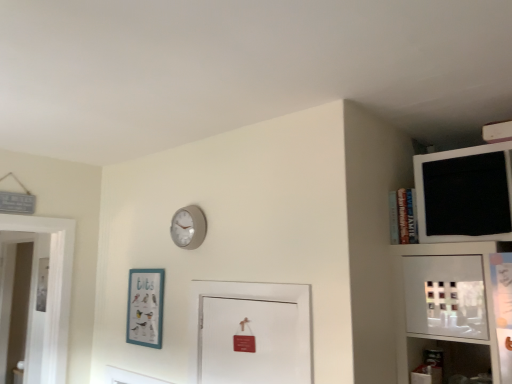
You are a GUI agent. You are given a task and a screenshot of the screen. Output one action in this format:
    pyautogui.click(x=<x>, y=<y>)
    Task: Click on the matte gray clock at upper center
    
    Given the screenshot: What is the action you would take?
    pyautogui.click(x=188, y=227)

Find the location of a particular element. black matte medicine cabinet at upper right is located at coordinates (465, 194).

From a real-world perspective, does black matte medicine cabinet at upper right sit lower than teal matte picture frame at lower left?

No.

Is the depth of black matte medicine cabinet at upper right greater than that of teal matte picture frame at lower left?

No, black matte medicine cabinet at upper right is closer to the camera.

Where is `medicine cabinet in front of the teal matte picture frame at lower left`? The image size is (512, 384). medicine cabinet in front of the teal matte picture frame at lower left is located at coordinates (465, 194).

Which object is thinner, black matte medicine cabinet at upper right or teal matte picture frame at lower left?

teal matte picture frame at lower left.

Which object is wider, matte gray clock at upper center or black matte medicine cabinet at upper right?

With larger width is black matte medicine cabinet at upper right.

Is matte gray clock at upper center turned away from black matte medicine cabinet at upper right?

No, matte gray clock at upper center is not facing away from black matte medicine cabinet at upper right.

Can black matte medicine cabinet at upper right be found inside matte gray clock at upper center?

No, black matte medicine cabinet at upper right is not inside matte gray clock at upper center.

From a real-world perspective, does matte gray clock at upper center sit lower than black matte medicine cabinet at upper right?

Yes.

Which object is closer to the camera taking this photo, teal matte picture frame at lower left or matte gray clock at upper center?

matte gray clock at upper center is in front.

Considering the relative positions of teal matte picture frame at lower left and matte gray clock at upper center in the image provided, is teal matte picture frame at lower left to the right of matte gray clock at upper center from the viewer's perspective?

In fact, teal matte picture frame at lower left is to the left of matte gray clock at upper center.

How distant is teal matte picture frame at lower left from matte gray clock at upper center?

They are 17.36 inches apart.

Would you say matte gray clock at upper center is part of teal matte picture frame at lower left's contents?

No, matte gray clock at upper center is not a part of teal matte picture frame at lower left.

Relative to black matte medicine cabinet at upper right, is teal matte picture frame at lower left in front or behind?

teal matte picture frame at lower left is positioned farther from the viewer than black matte medicine cabinet at upper right.

From the picture: Who is taller, teal matte picture frame at lower left or black matte medicine cabinet at upper right?

With more height is teal matte picture frame at lower left.

Who is bigger, teal matte picture frame at lower left or black matte medicine cabinet at upper right?

With larger size is black matte medicine cabinet at upper right.

Based on the photo, from the image's perspective, relative to black matte medicine cabinet at upper right, is teal matte picture frame at lower left above or below?

teal matte picture frame at lower left is situated lower than black matte medicine cabinet at upper right in the image.

How many degrees apart are the facing directions of black matte medicine cabinet at upper right and matte gray clock at upper center?

The facing directions of black matte medicine cabinet at upper right and matte gray clock at upper center are 0.482 degrees apart.

Is black matte medicine cabinet at upper right beside matte gray clock at upper center?

No, black matte medicine cabinet at upper right is not touching matte gray clock at upper center.

Is black matte medicine cabinet at upper right aimed at matte gray clock at upper center?

No, black matte medicine cabinet at upper right is not aimed at matte gray clock at upper center.

Is black matte medicine cabinet at upper right completely or partially outside of matte gray clock at upper center?

Yes.

Visually, is matte gray clock at upper center positioned to the left or to the right of teal matte picture frame at lower left?

From the image, it's evident that matte gray clock at upper center is to the right of teal matte picture frame at lower left.

In the scene shown: Considering the sizes of matte gray clock at upper center and teal matte picture frame at lower left in the image, is matte gray clock at upper center taller or shorter than teal matte picture frame at lower left?

Clearly, matte gray clock at upper center is shorter compared to teal matte picture frame at lower left.

From the image's perspective, is matte gray clock at upper center below teal matte picture frame at lower left?

No, from the image's perspective, matte gray clock at upper center is not beneath teal matte picture frame at lower left.

From a real-world perspective, is matte gray clock at upper center above or below teal matte picture frame at lower left?

matte gray clock at upper center is above teal matte picture frame at lower left.

Locate an element on the screen. picture frame that appears below the black matte medicine cabinet at upper right (from a real-world perspective) is located at coordinates (145, 307).

In order to click on medicine cabinet that appears above the matte gray clock at upper center (from the image's perspective) in this screenshot , I will do `click(465, 194)`.

From the image, which object appears to be nearer to black matte medicine cabinet at upper right, matte gray clock at upper center or teal matte picture frame at lower left?

matte gray clock at upper center is positioned closer to the anchor black matte medicine cabinet at upper right.

Looking at the image, which one is located further to matte gray clock at upper center, black matte medicine cabinet at upper right or teal matte picture frame at lower left?

black matte medicine cabinet at upper right lies further to matte gray clock at upper center than the other object.

Looking at the image, which one is located closer to matte gray clock at upper center, teal matte picture frame at lower left or black matte medicine cabinet at upper right?

teal matte picture frame at lower left lies closer to matte gray clock at upper center than the other object.

Based on their spatial positions, is black matte medicine cabinet at upper right or matte gray clock at upper center closer to teal matte picture frame at lower left?

matte gray clock at upper center is closer to teal matte picture frame at lower left.

Based on their spatial positions, is teal matte picture frame at lower left or matte gray clock at upper center further from black matte medicine cabinet at upper right?

The object further to black matte medicine cabinet at upper right is teal matte picture frame at lower left.

From the image, which object appears to be nearer to teal matte picture frame at lower left, matte gray clock at upper center or black matte medicine cabinet at upper right?

matte gray clock at upper center.

Where is `wall clock between teal matte picture frame at lower left and black matte medicine cabinet at upper right in the horizontal direction`? This screenshot has height=384, width=512. wall clock between teal matte picture frame at lower left and black matte medicine cabinet at upper right in the horizontal direction is located at coordinates (188, 227).